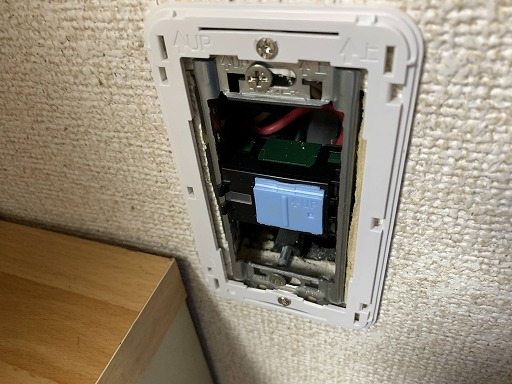
Locate an element on the screen. This screenshot has height=384, width=512. beige textured wall covering is located at coordinates (259, 341), (173, 244), (105, 229), (303, 334), (456, 103), (498, 66), (497, 285), (111, 185), (46, 35), (28, 146).